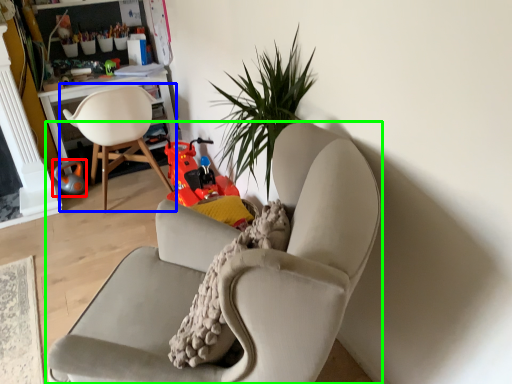
Question: Based on their relative distances, which object is farther from toy (highlighted by a red box)? Choose from chair (highlighted by a blue box) and chair (highlighted by a green box).

Choices:
 (A) chair
 (B) chair

Answer: (B)